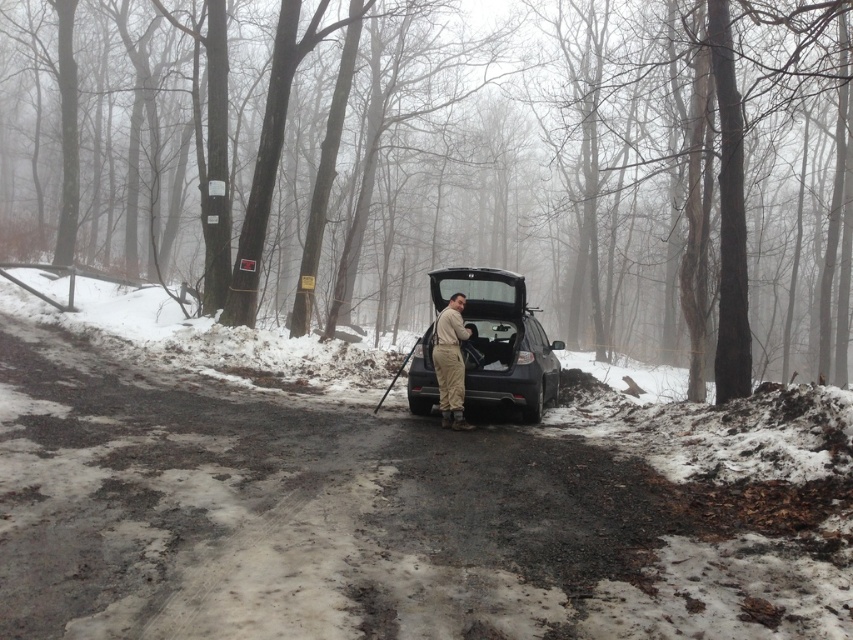
You are a delivery drone operator. Your drone needs to land safely between the satin black suv at center and the tan fabric jumpsuit at center. Based on their positions, which side of the two objects should the drone aim for to land?

The satin black suv at center is positioned on the right side of tan fabric jumpsuit at center. Therefore, the drone should aim for the left side of the tan fabric jumpsuit at center to land safely between them.

You are a hiker lost in a snowy forest and see a car parked in the center of the scene. You notice a point marked at coordinates [502,339]. What object is located at that point?

The point at coordinates [502,339] marks the location of the satin black suv at center.

You are a delivery drone trying to land in the forest clearing. The satin black suv at center and the tan fabric jumpsuit at center are in your path. Based on their sizes, which object should you avoid to ensure a safe landing?

The tan fabric jumpsuit at center occupies more space than the satin black suv at center, so you should avoid the tan fabric jumpsuit at center to ensure a safe landing.